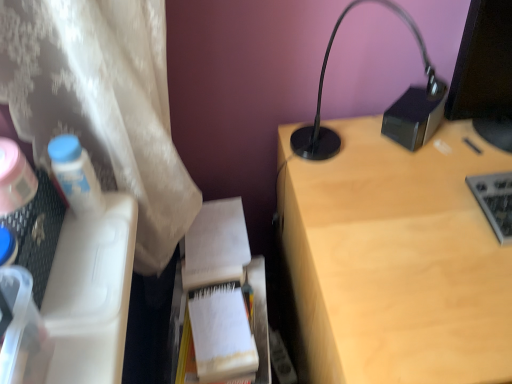
This screenshot has width=512, height=384. Find the location of `vacant area that is in front of black metallic lamp at upper right`. vacant area that is in front of black metallic lamp at upper right is located at coordinates (381, 243).